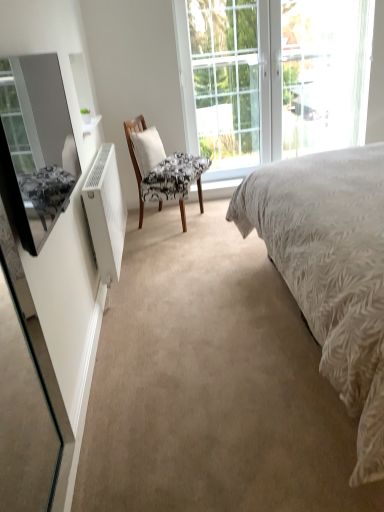
Question: Would you say patterned fabric chair at center is inside or outside white textured bed at center?

Choices:
 (A) outside
 (B) inside

Answer: (A)

Question: From the image's perspective, is patterned fabric chair at center positioned above or below white textured bed at center?

Choices:
 (A) below
 (B) above

Answer: (B)

Question: Considering the real-world distances, which object is closest to the white textured bed at center?

Choices:
 (A) white fabric pillow at center
 (B) clear glass door at center
 (C) patterned fabric chair at center
 (D) clear glass window at upper center
 (E) white matte radiator at left

Answer: (E)

Question: Which is nearer to the white fabric pillow at center?

Choices:
 (A) white matte radiator at left
 (B) matte black mirror at left
 (C) white textured bed at center
 (D) clear glass door at center
 (E) patterned fabric chair at center

Answer: (E)